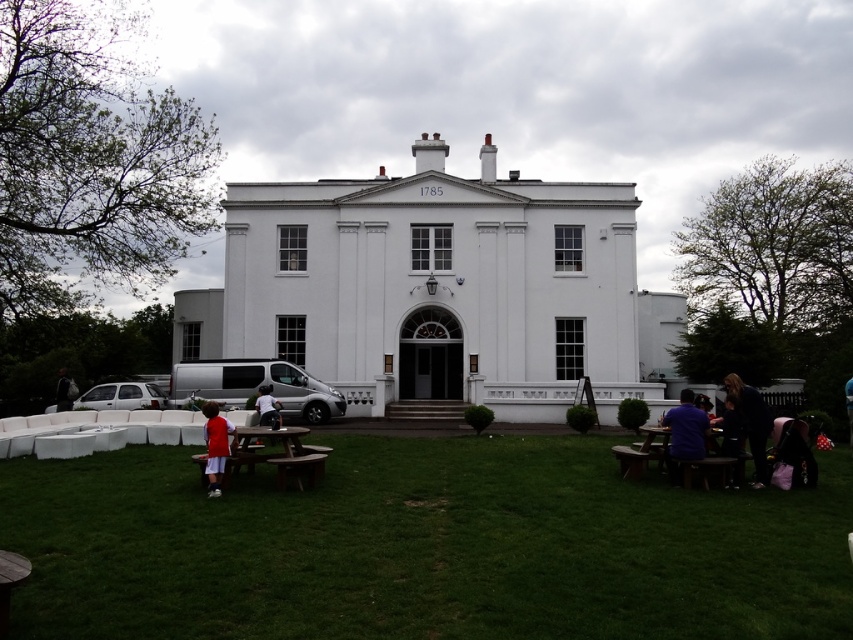
You are standing at the entrance of the building and want to join the group near the picnic tables. From your vantage point, does the purple shirt at lower right appear wider than the brown wooden picnic table at lower right?

The purple shirt at lower right might be wider than the brown wooden picnic table at lower right, so it could appear wider from your vantage point.

You are standing in front of the building and want to pick up both the light blue denim shorts at center and the black fabric bag at lower left. Which item should you move towards first to reach the one closer to you?

You should move towards the light blue denim shorts at center first because it is closer to you than the black fabric bag at lower left.